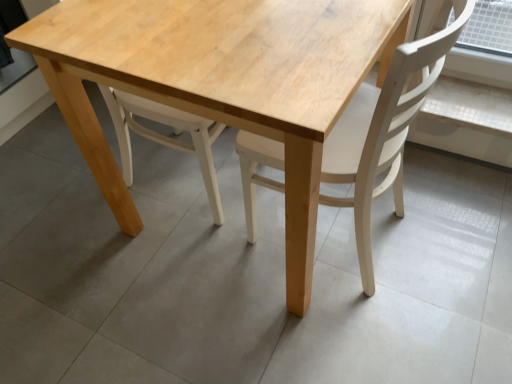
Locate an element on the screen. This screenshot has width=512, height=384. vacant space that is to the left of natural wood table at center is located at coordinates (75, 230).